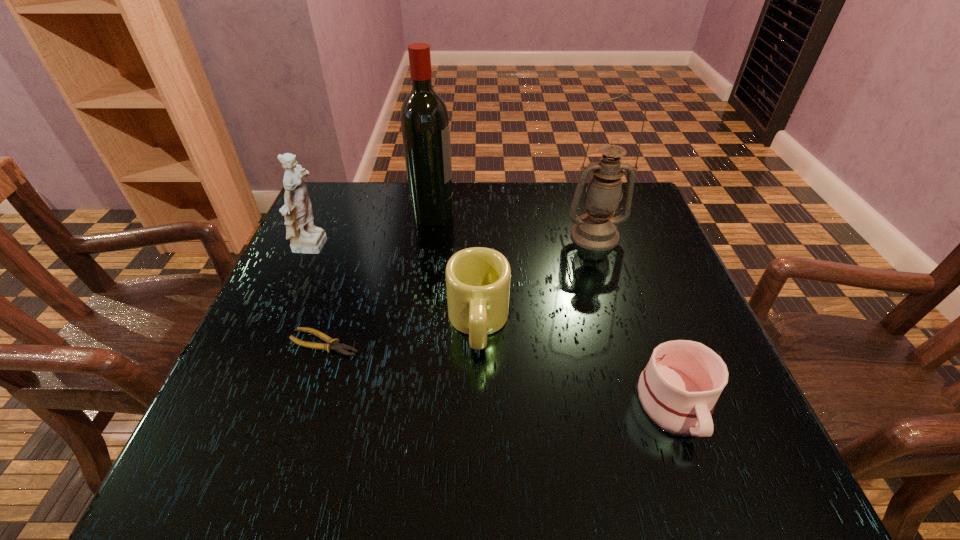
In order to click on the fourth object from right to left in this screenshot , I will do `click(425, 126)`.

You are a GUI agent. You are given a task and a screenshot of the screen. Output one action in this format:
    pyautogui.click(x=<x>, y=<y>)
    Task: Click on the oil lamp
    
    Given the screenshot: What is the action you would take?
    click(596, 230)

Locate an element on the screen. the third tallest object is located at coordinates (304, 237).

This screenshot has width=960, height=540. I want to click on the farther mug, so click(477, 279).

What are the coordinates of `the third object from right to left` in the screenshot? It's located at (477, 279).

The height and width of the screenshot is (540, 960). I want to click on the right mug, so click(x=678, y=389).

The width and height of the screenshot is (960, 540). In order to click on the fifth tallest object in this screenshot , I will do `click(678, 389)`.

Where is `pliers`? The width and height of the screenshot is (960, 540). pliers is located at coordinates (332, 344).

At what (x,y) coordinates should I click in order to perform the action: click on free location located 0.230m on the label of the wine bottle. Please return your answer as a coordinate pair (x, y). Image resolution: width=960 pixels, height=540 pixels. Looking at the image, I should click on (541, 214).

Locate an element on the screen. free region located on the front of the second tallest object is located at coordinates (623, 328).